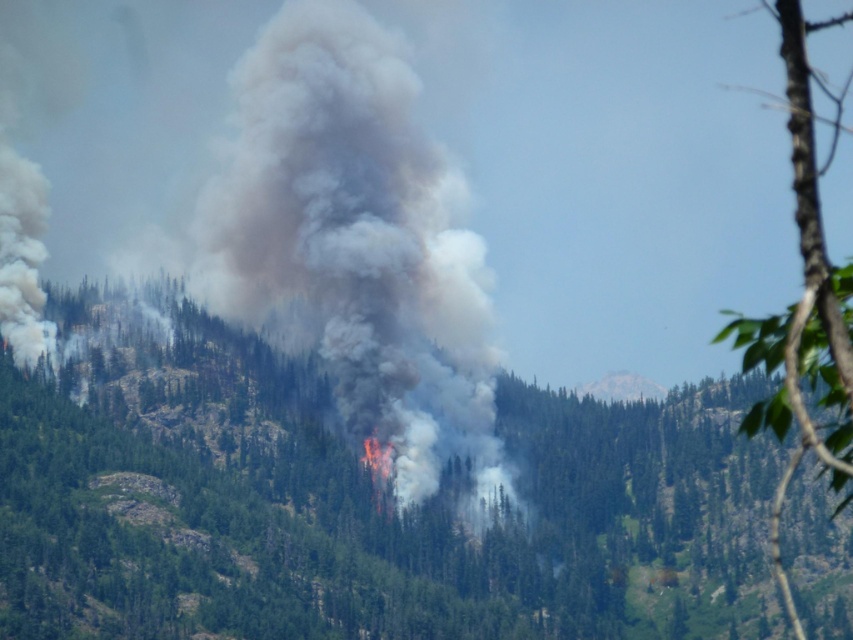
You are a firefighter trying to navigate to the green leafy tree at center in the mountainous area. The coordinates of the tree are given as point (x=357, y=500). If you are currently at point 0.5, 0.5, which direction should you move to reach the tree?

The green leafy tree at center is located at point (x=357, y=500). Since your current position is at 0.5, 0.5, you should move northeast to reach the tree.

You are a firefighter trying to navigate through the forest to reach the fire. You see a green leafy tree at center. Based on its coordinates, can you estimate its position relative to your current location?

The green leafy tree at center is located at coordinates point (x=357, y=500), which means it is positioned slightly to the right and above your current position in the forest.